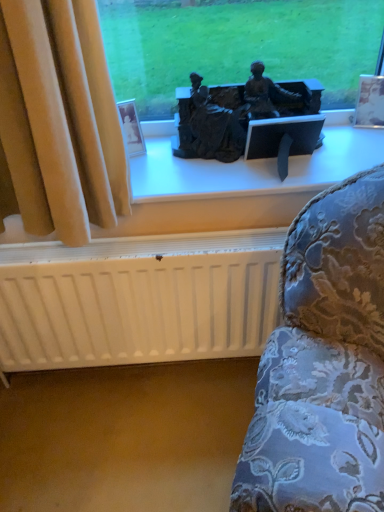
Identify the location of free spot in front of bronze statue at center. The height and width of the screenshot is (512, 384). (236, 181).